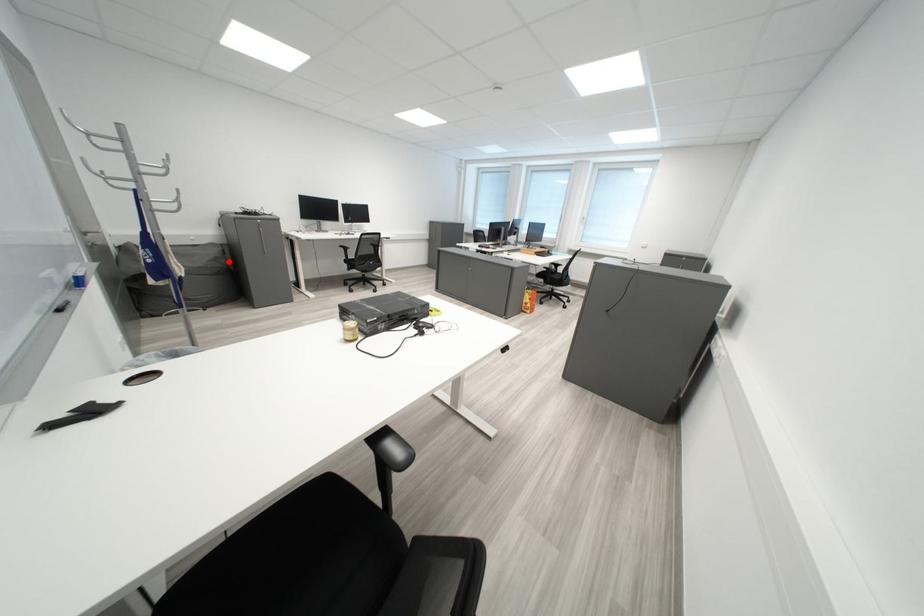
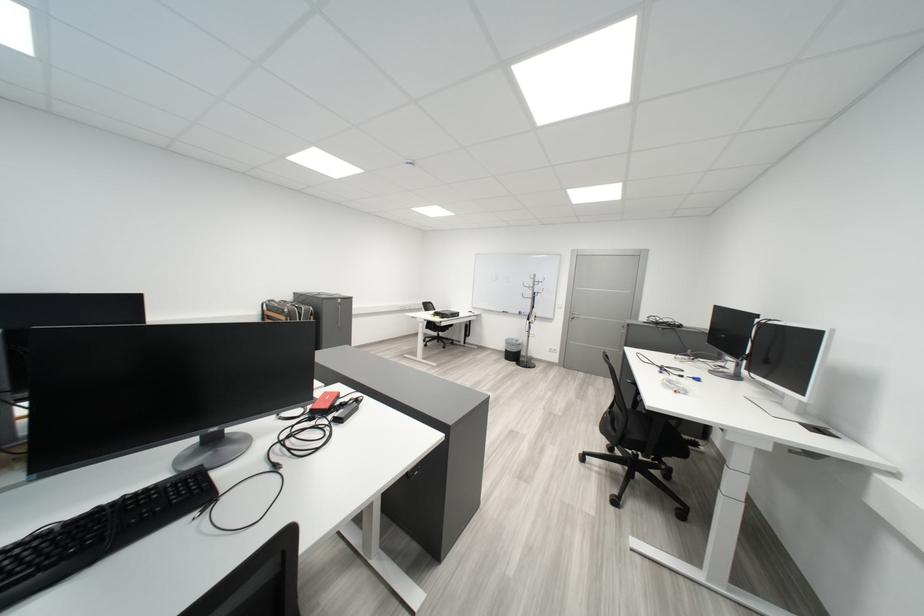
Question: I am providing you with two images of the same scene from different viewpoints. A red point is marked on the first image. At the location where the point appears in image 1, is it still visible in image 2?

Choices:
 (A) Yes
 (B) No

Answer: (B)